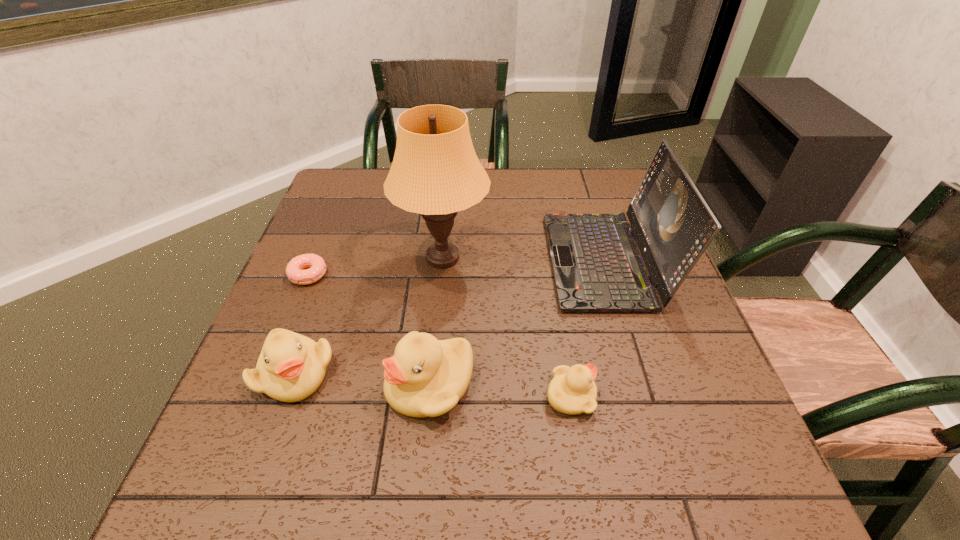
The ducklings are evenly distributed in the image. To maintain this, where would you place another duckling on the right? Please point to a free space. Please provide its 2D coordinates. Your answer should be formatted as a tuple, i.e. [(x, y)], where the tuple contains the x and y coordinates of a point satisfying the conditions above.

[(718, 409)]